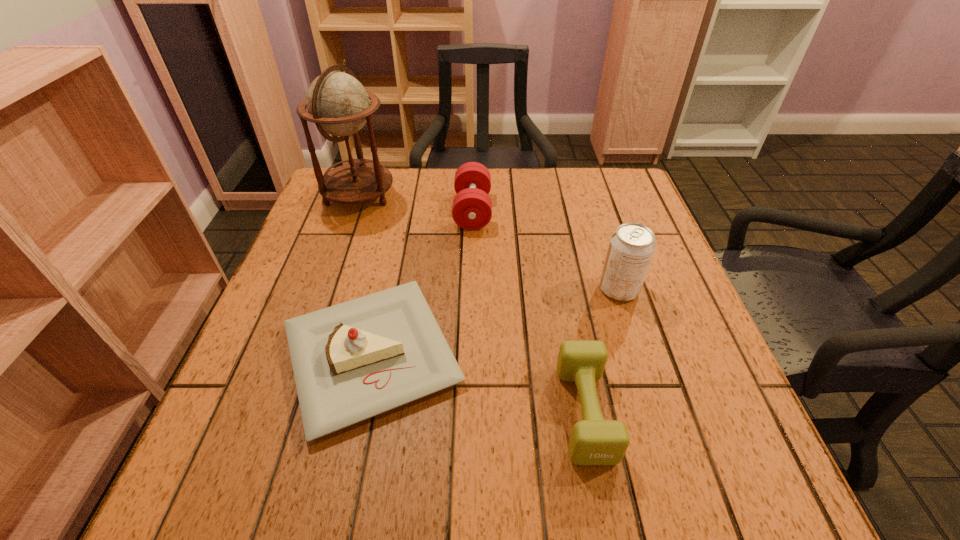
At what (x,y) coordinates should I click in order to perform the action: click on the tallest object. Please return your answer as a coordinate pair (x, y). The image size is (960, 540). Looking at the image, I should click on (338, 104).

Identify the location of the fourth shortest object. This screenshot has height=540, width=960. (631, 248).

Locate an element on the screen. the rightmost object is located at coordinates (631, 248).

Image resolution: width=960 pixels, height=540 pixels. Identify the location of the left dumbbell. (472, 209).

Find the location of a particular element. The image size is (960, 540). the taller dumbbell is located at coordinates (472, 209).

The width and height of the screenshot is (960, 540). In order to click on cake in this screenshot , I will do `click(352, 361)`.

Locate an element on the screen. This screenshot has height=540, width=960. the fourth object from left to right is located at coordinates [594, 441].

Find the location of a particular element. the nearer dumbbell is located at coordinates (594, 441).

I want to click on vacant space located on the surface of the tallest object, so click(x=514, y=195).

Identify the location of blank space located 0.050m on the left of the soda can. (575, 289).